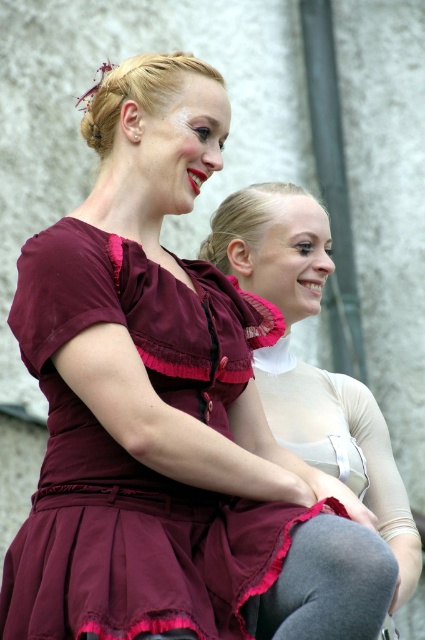
Between burgundy satin dress at center and matte burgundy dress at center, which one is positioned higher?

matte burgundy dress at center is above.

Who is more forward, (x=14, y=628) or (x=391, y=484)?

Positioned in front is point (x=14, y=628).

Image resolution: width=425 pixels, height=640 pixels. I want to click on burgundy satin dress at center, so click(133, 458).